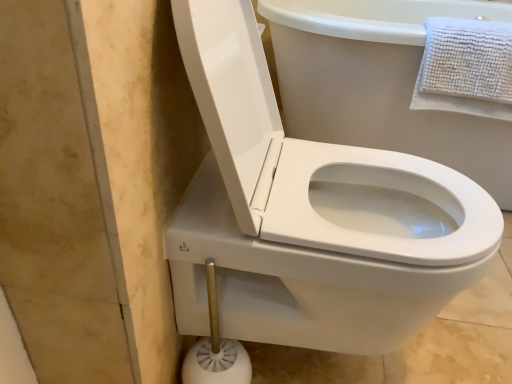
Question: Is white glossy toilet at center taller or shorter than white textured towel at upper right?

Choices:
 (A) tall
 (B) short

Answer: (A)

Question: Does point (293, 336) appear closer or farther from the camera than point (442, 87)?

Choices:
 (A) closer
 (B) farther

Answer: (A)

Question: Based on their relative distances, which object is nearer to the white glossy toilet at center?

Choices:
 (A) white textured towel at upper right
 (B) white plastic toilet brush at lower center

Answer: (B)

Question: Which is farther from the white glossy toilet at center?

Choices:
 (A) white textured towel at upper right
 (B) white plastic toilet brush at lower center

Answer: (A)